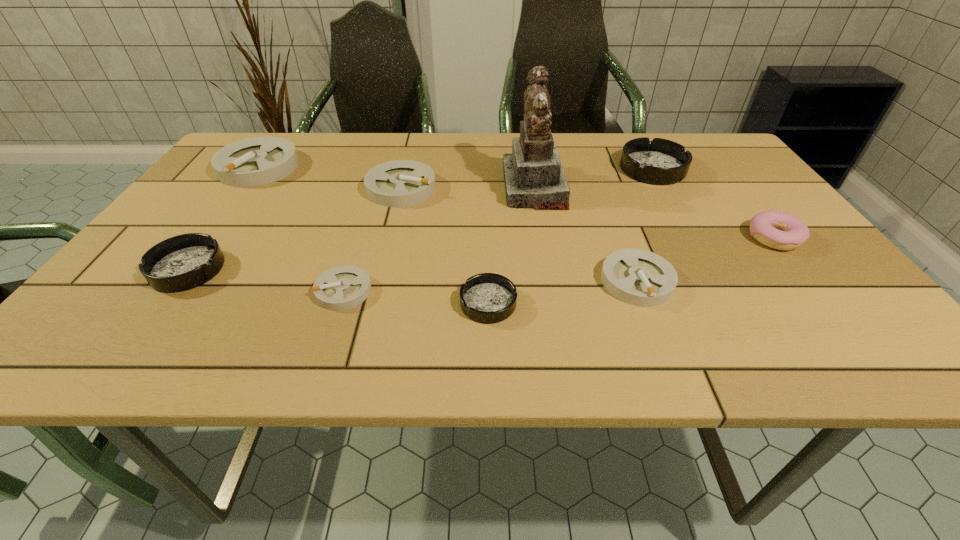
This screenshot has height=540, width=960. Find the location of `blank space located on the back of the second smallest gray ashtray`. blank space located on the back of the second smallest gray ashtray is located at coordinates (602, 188).

Image resolution: width=960 pixels, height=540 pixels. Identify the location of vacant position located 0.100m on the back of the second dark ashtray from left to right. (488, 252).

At what (x,y) coordinates should I click in order to perform the action: click on free point located 0.090m on the front of the smallest gray ashtray. Please return your answer as a coordinate pair (x, y). Looking at the image, I should click on (325, 349).

Where is `figurine located at the far edge`? The image size is (960, 540). figurine located at the far edge is located at coordinates (534, 177).

Image resolution: width=960 pixels, height=540 pixels. Identify the location of object that is at the near edge. (488, 298).

Locate an element on the screen. ashtray that is positioned at the right edge is located at coordinates (658, 162).

Find the location of a particular element. doughnut situated at the right edge is located at coordinates click(778, 230).

This screenshot has height=540, width=960. I want to click on object that is at the far left corner, so click(257, 161).

Where is `object located in the far right corner section of the desktop`? This screenshot has height=540, width=960. object located in the far right corner section of the desktop is located at coordinates point(658,162).

In the image, there is a desktop. Where is `vacant region at the far edge`? vacant region at the far edge is located at coordinates coord(385,150).